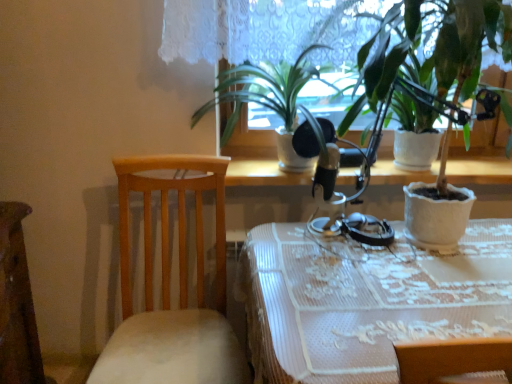
Question: Relative to white textured pot at right, which is the 2th houseplant from left to right, is green matte plant at center, acting as the first houseplant starting from the left, in front or behind?

Choices:
 (A) front
 (B) behind

Answer: (B)

Question: Considering the relative positions of green matte plant at center, which is counted as the 2th houseplant, starting from the right, and white textured pot at right, which is the 2th houseplant from left to right, in the image provided, is green matte plant at center, which is counted as the 2th houseplant, starting from the right, to the left or to the right of white textured pot at right, which is the 2th houseplant from left to right,?

Choices:
 (A) right
 (B) left

Answer: (B)

Question: Which object is the farthest from the white textured pot at right, which is the 2th houseplant from left to right?

Choices:
 (A) white lace tablecloth at center
 (B) wooden chair at left
 (C) green matte plant at center, acting as the first houseplant starting from the left

Answer: (B)

Question: Considering the real-world distances, which object is closest to the white lace tablecloth at center?

Choices:
 (A) green matte plant at center, which is counted as the 2th houseplant, starting from the right
 (B) wooden chair at left
 (C) white textured pot at right, which is the 2th houseplant from left to right

Answer: (B)